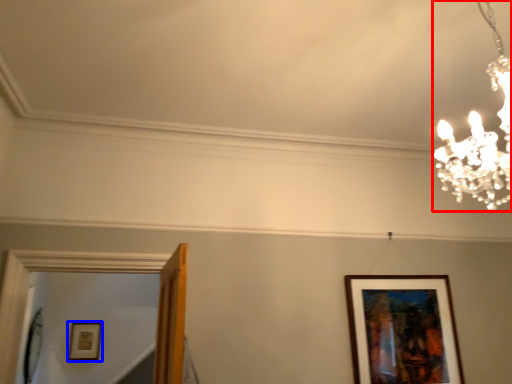
Question: Which of the following is the closest to the observer, lamp (highlighted by a red box) or picture frame (highlighted by a blue box)?

Choices:
 (A) lamp
 (B) picture frame

Answer: (A)